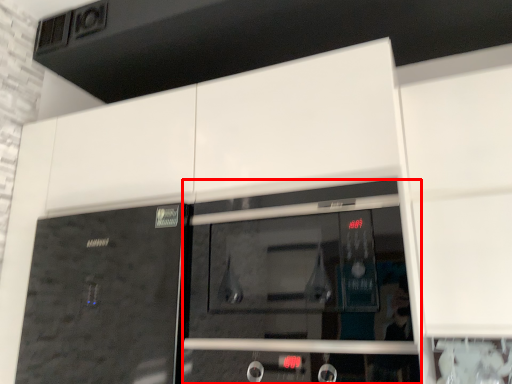
Question: From the image's perspective, what is the correct spatial positioning of screen door (annotated by the red box) in reference to door?

Choices:
 (A) below
 (B) above

Answer: (B)